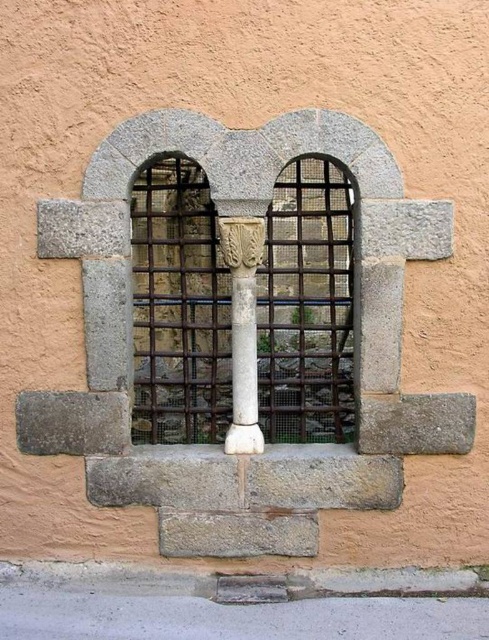
Question: Among these points, which one is nearest to the camera?

Choices:
 (A) (219, 419)
 (B) (222, 241)

Answer: (B)

Question: Which point is farther to the camera?

Choices:
 (A) white stone column at center
 (B) stone arched window at center

Answer: (B)

Question: Does stone arched window at center have a larger size compared to white stone column at center?

Choices:
 (A) yes
 (B) no

Answer: (A)

Question: Is stone arched window at center to the left of white stone column at center from the viewer's perspective?

Choices:
 (A) yes
 (B) no

Answer: (B)

Question: Can you confirm if stone arched window at center is thinner than white stone column at center?

Choices:
 (A) yes
 (B) no

Answer: (B)